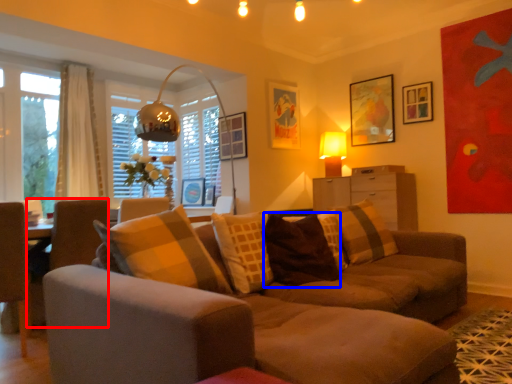
Question: Which of the following is the farthest to the observer, swivel chair (highlighted by a red box) or pillow (highlighted by a blue box)?

Choices:
 (A) swivel chair
 (B) pillow

Answer: (B)